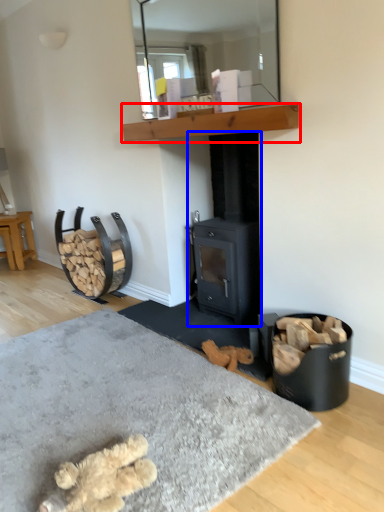
Question: Which object appears closest to the camera in this image, shelf (highlighted by a red box) or wood burning stove (highlighted by a blue box)?

Choices:
 (A) shelf
 (B) wood burning stove

Answer: (A)